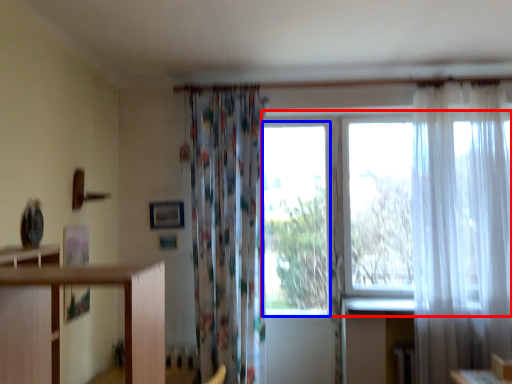
Question: Which point is closer to the camera, window screen (highlighted by a red box) or window (highlighted by a blue box)?

Choices:
 (A) window screen
 (B) window

Answer: (A)